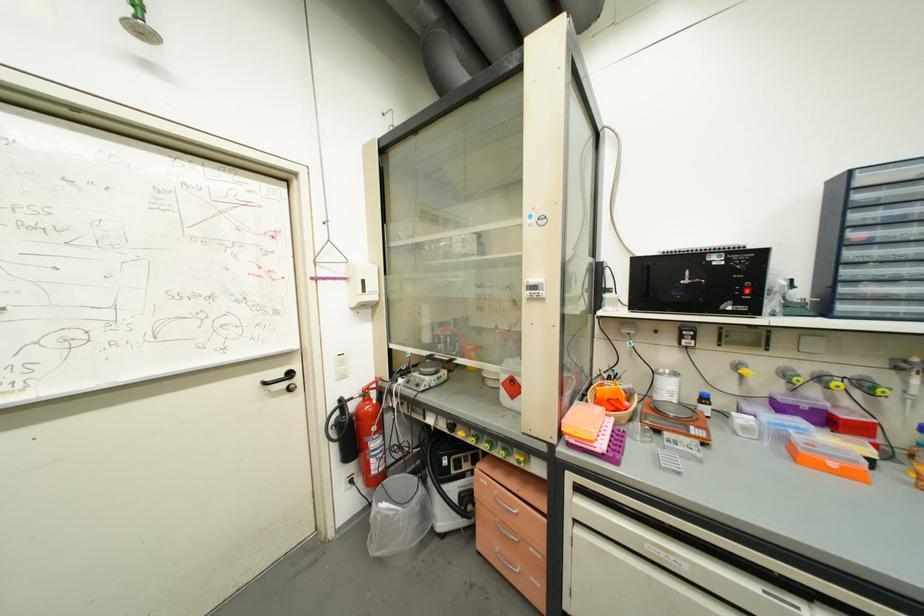
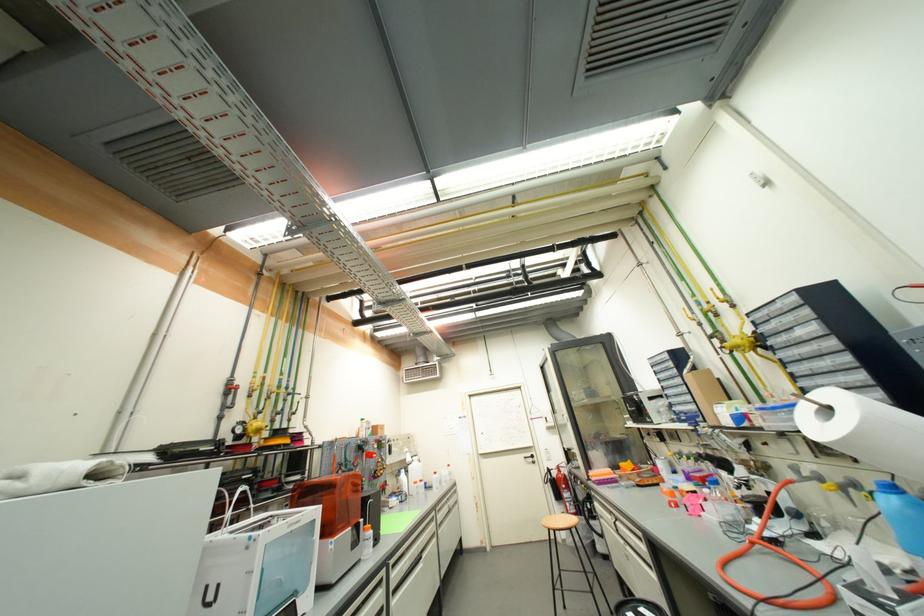
In the second image, find the point that corresponds to (x=271, y=386) in the first image.

(530, 459)